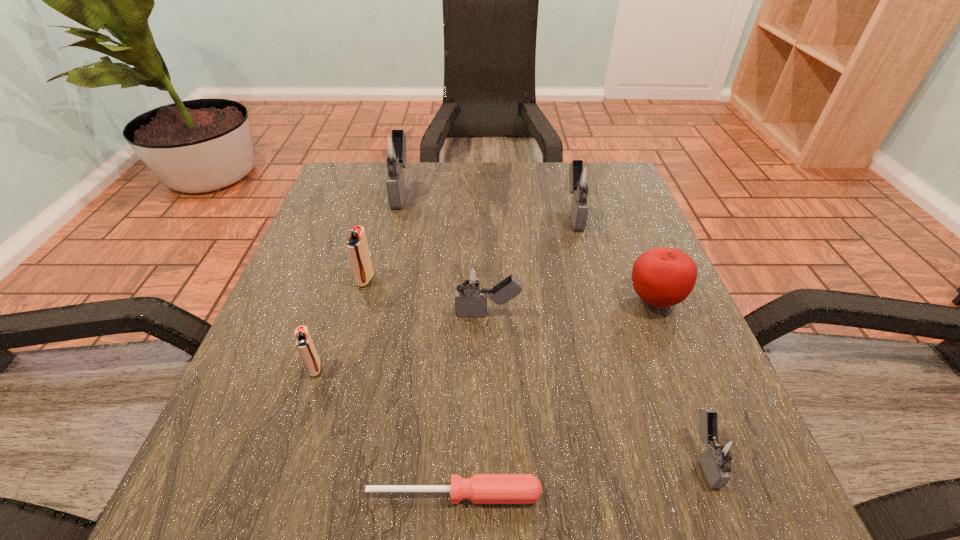
Locate an element on the screen. vacant space that satisfies the following two spatial constraints: 1. on the back side of the apple; 2. on the right side of the third farthest gray igniter is located at coordinates [488, 300].

Where is `vacant space that satisfies the following two spatial constraints: 1. on the back side of the nearest igniter; 2. on the right side of the apple`? The width and height of the screenshot is (960, 540). vacant space that satisfies the following two spatial constraints: 1. on the back side of the nearest igniter; 2. on the right side of the apple is located at coordinates (644, 300).